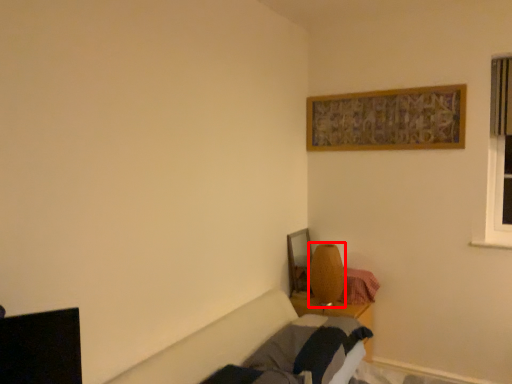
Question: Where is table lamp (annotated by the red box) located in relation to bed frame in the image?

Choices:
 (A) left
 (B) right

Answer: (B)